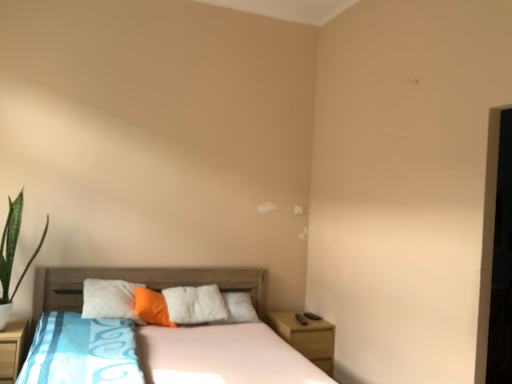
Question: Considering the positions of wooden bed at center and green leafy plant at left in the image, is wooden bed at center wider or thinner than green leafy plant at left?

Choices:
 (A) thin
 (B) wide

Answer: (B)

Question: Is point (321, 374) closer or farther from the camera than point (12, 221)?

Choices:
 (A) farther
 (B) closer

Answer: (B)

Question: Considering the real-world distances, which object is farthest from the wooden nightstand at lower right, the second nightstand positioned from the front?

Choices:
 (A) wooden bed at center
 (B) wooden nightstand at lower left, the 1th nightstand viewed from the front
 (C) green leafy plant at left
 (D) orange soft pillow at center

Answer: (C)

Question: Estimate the real-world distances between objects in this image. Which object is closer to the wooden nightstand at lower right, the second nightstand positioned from the front?

Choices:
 (A) wooden bed at center
 (B) orange soft pillow at center
 (C) wooden nightstand at lower left, the 2th nightstand in the back-to-front sequence
 (D) green leafy plant at left

Answer: (A)